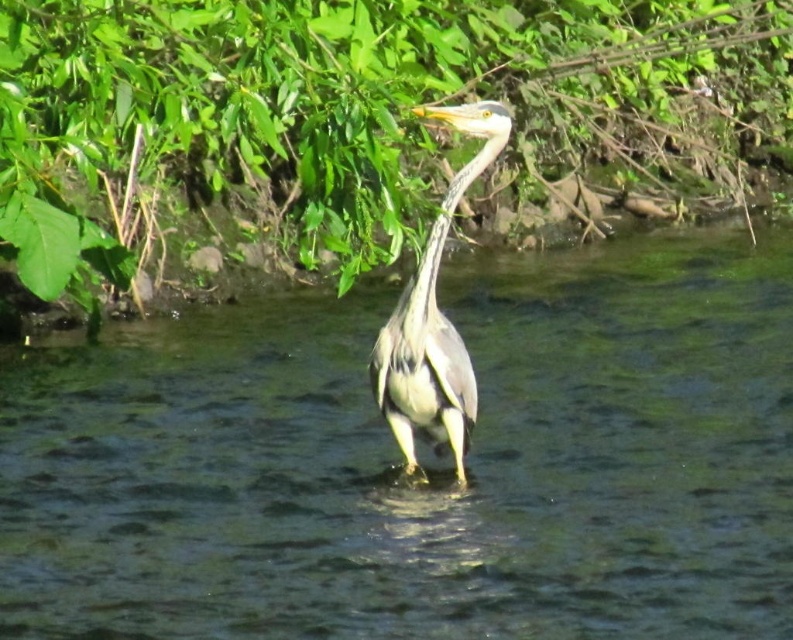
Question: Which point is closer to the camera?

Choices:
 (A) (404, 592)
 (B) (424, 272)

Answer: (B)

Question: Which object is farther from the camera taking this photo?

Choices:
 (A) gray matte neck at upper center
 (B) clear water at center

Answer: (B)

Question: Does gray matte heron at center appear on the left side of gray matte neck at upper center?

Choices:
 (A) yes
 (B) no

Answer: (B)

Question: Is green leafy vegetation at upper center positioned at the back of gray matte heron at center?

Choices:
 (A) no
 (B) yes

Answer: (B)

Question: Which is farther from the green leafy vegetation at upper center?

Choices:
 (A) gray matte heron at center
 (B) gray matte neck at upper center

Answer: (B)

Question: Considering the relative positions of clear water at center and green leafy vegetation at upper center in the image provided, where is clear water at center located with respect to green leafy vegetation at upper center?

Choices:
 (A) above
 (B) below

Answer: (B)